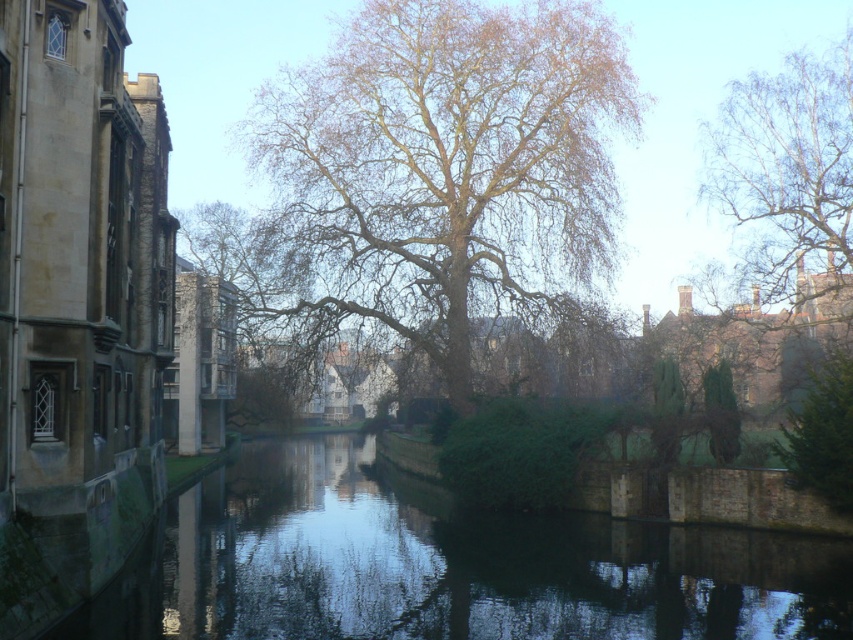
Who is more distant from viewer, (x=294, y=582) or (x=821, y=76)?

Point (x=821, y=76)

Is dark green water at center positioned before white textured bark at upper right?

Yes, dark green water at center is closer to the viewer.

Is point (195, 541) positioned behind point (753, 250)?

That is False.

Find the location of a particular element. dark green water at center is located at coordinates (444, 564).

Is bare branches tree at center to the left of dark green water at center from the viewer's perspective?

In fact, bare branches tree at center is to the right of dark green water at center.

Who is more distant from viewer, (367, 28) or (451, 618)?

Positioned behind is point (367, 28).

At what (x,y) coordinates should I click in order to perform the action: click on bare branches tree at center. Please return your answer as a coordinate pair (x, y). The height and width of the screenshot is (640, 853). Looking at the image, I should click on (440, 168).

You are a GUI agent. You are given a task and a screenshot of the screen. Output one action in this format:
    pyautogui.click(x=<x>, y=<y>)
    Task: Click on the bare branches tree at center
    This screenshot has width=853, height=640.
    Given the screenshot: What is the action you would take?
    pyautogui.click(x=440, y=168)

Does bare branches tree at center appear over white textured bark at upper right?

Correct, bare branches tree at center is located above white textured bark at upper right.

Find the location of a particular element. The height and width of the screenshot is (640, 853). bare branches tree at center is located at coordinates (440, 168).